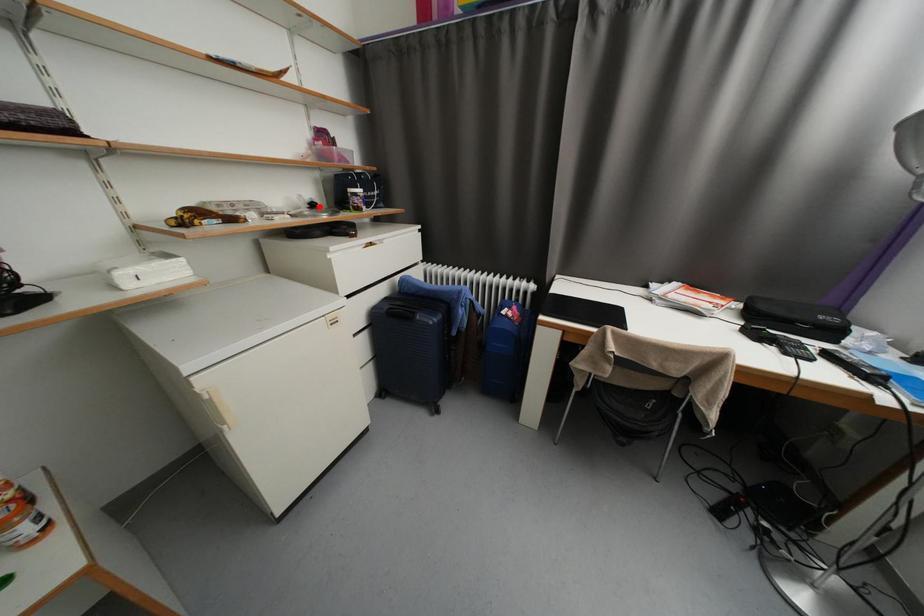
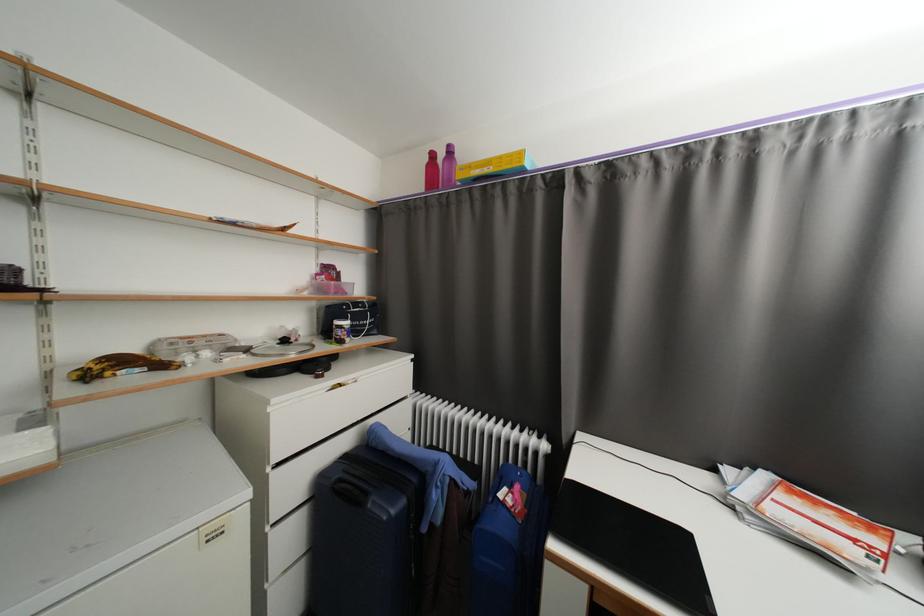
Where in the second image is the point corresponding to the highlighted location from the first image?

(290, 342)